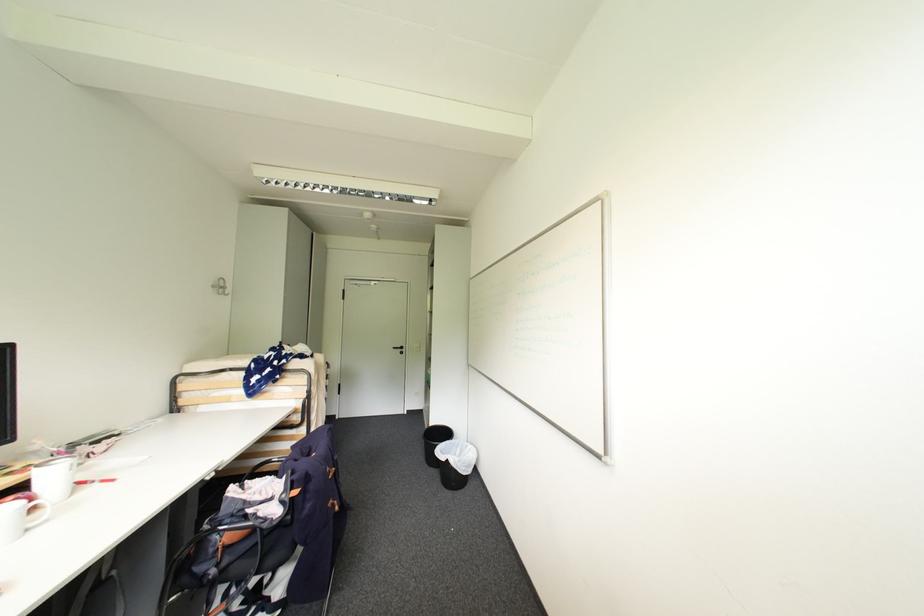
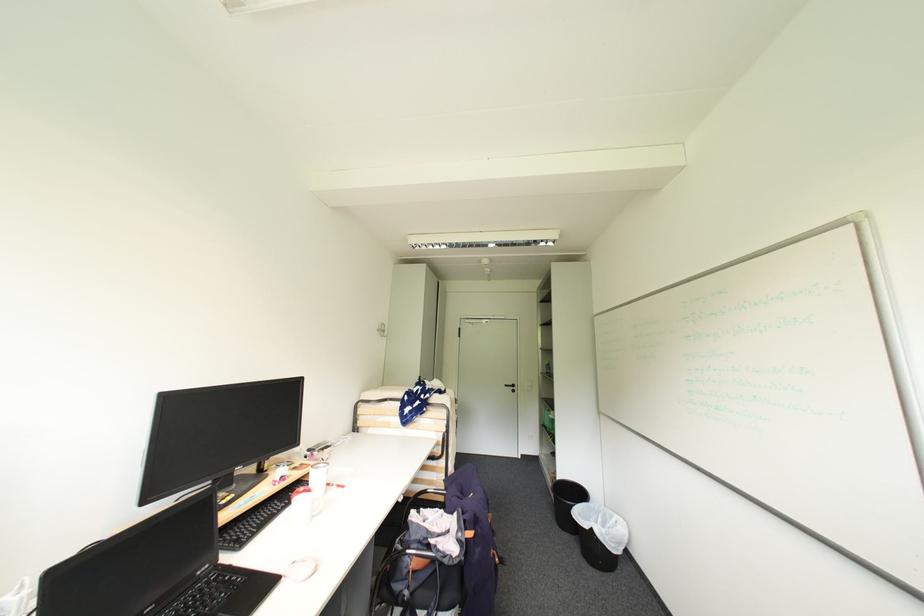
Where in the second image is the point corresponding to point 252,517 from the first image?

(435, 548)